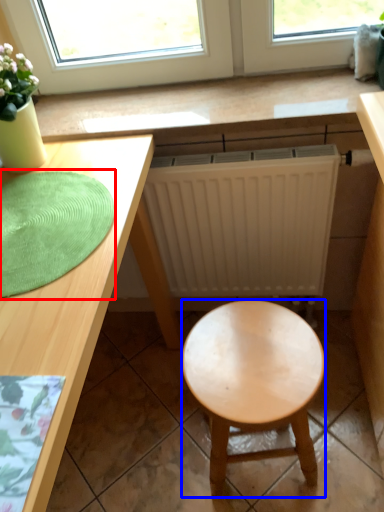
Question: Which object is closer to the camera taking this photo, mat (highlighted by a red box) or stool (highlighted by a blue box)?

Choices:
 (A) mat
 (B) stool

Answer: (A)